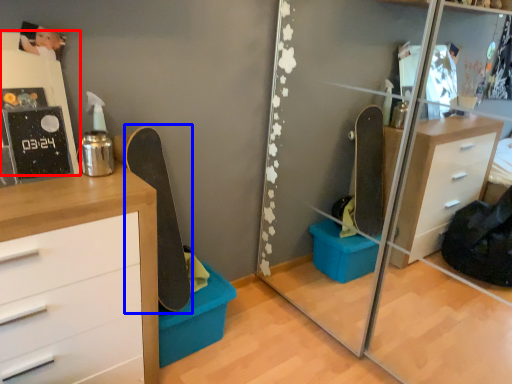
Question: Which of the following is the closest to the observer, shelf (highlighted by a red box) or skateboard (highlighted by a blue box)?

Choices:
 (A) shelf
 (B) skateboard

Answer: (A)